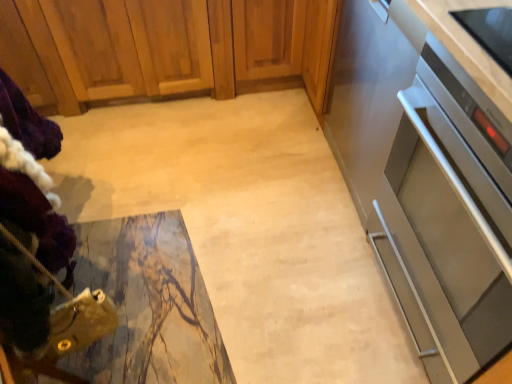
Where is `stainless steel oven at right`? This screenshot has height=384, width=512. stainless steel oven at right is located at coordinates (369, 90).

Describe the element at coordinates (369, 90) in the screenshot. This screenshot has height=384, width=512. I see `stainless steel oven at right` at that location.

What is the approximate height of wooden cabinet at upper left?

The height of wooden cabinet at upper left is 22.88 inches.

What is the approximate width of satin silver oven at right?

satin silver oven at right is 55.56 centimeters wide.

Identify the location of stainless steel oven at right. (369, 90).

You are a GUI agent. You are given a task and a screenshot of the screen. Output one action in this format:
    pyautogui.click(x=<x>, y=<y>)
    Task: Click on the cabinetry that is above the stainless steel oven at right (from the image's perspective)
    This screenshot has width=512, height=384.
    Given the screenshot: What is the action you would take?
    pyautogui.click(x=164, y=49)

Which of these two, stainless steel oven at right or wooden cabinet at upper left, stands taller?

stainless steel oven at right.

Which of these two, stainless steel oven at right or wooden cabinet at upper left, is bigger?

wooden cabinet at upper left.

From the image's perspective, is satin silver oven at right positioned above or below wooden cabinet at upper left?

satin silver oven at right is below wooden cabinet at upper left.

Would you say satin silver oven at right is inside or outside wooden cabinet at upper left?

satin silver oven at right exists outside the volume of wooden cabinet at upper left.

Is satin silver oven at right positioned behind wooden cabinet at upper left?

No, satin silver oven at right is in front of wooden cabinet at upper left.

How many degrees apart are the facing directions of satin silver oven at right and wooden cabinet at upper left?

satin silver oven at right and wooden cabinet at upper left are facing 1.23 degrees away from each other.

Is stainless steel oven at right not close to satin silver oven at right?

No, stainless steel oven at right is in close proximity to satin silver oven at right.

Is point (356, 98) closer or farther from the camera than point (456, 302)?

Point (356, 98) is farther from the camera than point (456, 302).

From the image's perspective, who appears lower, stainless steel oven at right or satin silver oven at right?

satin silver oven at right is shown below in the image.

You are a GUI agent. You are given a task and a screenshot of the screen. Output one action in this format:
    pyautogui.click(x=<x>, y=<y>)
    Task: Click on the appliance above the satin silver oven at right (from a real-world perspective)
    Image resolution: width=512 pixels, height=384 pixels.
    Given the screenshot: What is the action you would take?
    pyautogui.click(x=369, y=90)

Considering the sizes of objects satin silver oven at right and stainless steel oven at right in the image provided, who is bigger, satin silver oven at right or stainless steel oven at right?

Bigger between the two is stainless steel oven at right.

Do you think satin silver oven at right is within stainless steel oven at right, or outside of it?

The correct answer is: outside.

Is point (443, 241) more distant than point (346, 14)?

No, (443, 241) is in front of (346, 14).

Would you say wooden cabinet at upper left contains stainless steel oven at right?

That's incorrect, stainless steel oven at right is not inside wooden cabinet at upper left.

Based on their sizes in the image, would you say wooden cabinet at upper left is bigger or smaller than stainless steel oven at right?

Clearly, wooden cabinet at upper left is larger in size than stainless steel oven at right.

From the image's perspective, between wooden cabinet at upper left and stainless steel oven at right, who is located below?

stainless steel oven at right appears lower in the image.

Is wooden cabinet at upper left to the right of stainless steel oven at right from the viewer's perspective?

In fact, wooden cabinet at upper left is to the left of stainless steel oven at right.

Considering the sizes of objects wooden cabinet at upper left and satin silver oven at right in the image provided, who is taller, wooden cabinet at upper left or satin silver oven at right?

Standing taller between the two is satin silver oven at right.

Which point is more distant from viewer, (192, 56) or (482, 274)?

Point (192, 56)

Which of these two, wooden cabinet at upper left or satin silver oven at right, is wider?

wooden cabinet at upper left is wider.

Does wooden cabinet at upper left have a larger size compared to satin silver oven at right?

Indeed, wooden cabinet at upper left has a larger size compared to satin silver oven at right.

In the image, there is a stainless steel oven at right. Identify the location of cabinetry below it (from a real-world perspective). (164, 49).

Find the location of `cabinetry that is above the satin silver oven at right (from the image's perspective)`. cabinetry that is above the satin silver oven at right (from the image's perspective) is located at coordinates (164, 49).

When comparing their distances from wooden cabinet at upper left, does satin silver oven at right or stainless steel oven at right seem closer?

Based on the image, stainless steel oven at right appears to be nearer to wooden cabinet at upper left.

Looking at the image, which one is located further to stainless steel oven at right, satin silver oven at right or wooden cabinet at upper left?

Based on the image, wooden cabinet at upper left appears to be further to stainless steel oven at right.

Which object lies nearer to the anchor point satin silver oven at right, wooden cabinet at upper left or stainless steel oven at right?

Among the two, stainless steel oven at right is located nearer to satin silver oven at right.

When comparing their distances from satin silver oven at right, does stainless steel oven at right or wooden cabinet at upper left seem closer?

stainless steel oven at right is positioned closer to the anchor satin silver oven at right.

Based on their spatial positions, is stainless steel oven at right or satin silver oven at right closer to wooden cabinet at upper left?

stainless steel oven at right is closer to wooden cabinet at upper left.

Considering their positions, is wooden cabinet at upper left positioned further to stainless steel oven at right than satin silver oven at right?

wooden cabinet at upper left.

Where is `appliance located between wooden cabinet at upper left and satin silver oven at right in the left-right direction`? appliance located between wooden cabinet at upper left and satin silver oven at right in the left-right direction is located at coordinates (369, 90).